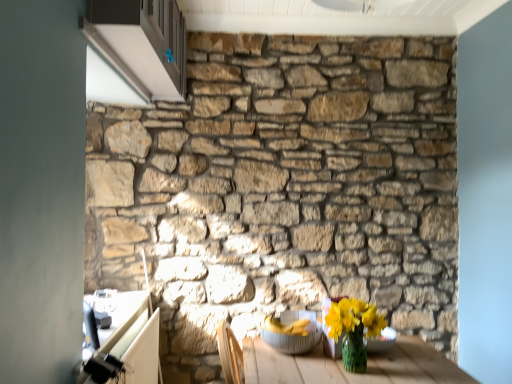
Question: Based on their positions, is natural stone wall at center located to the left or right of metallic silver bowl at lower center, which is counted as the first glass bowl, starting from the left?

Choices:
 (A) right
 (B) left

Answer: (B)

Question: Considering the positions of point (440, 170) and point (309, 319), is point (440, 170) closer or farther from the camera than point (309, 319)?

Choices:
 (A) farther
 (B) closer

Answer: (A)

Question: Which of these objects is positioned closest to the natural stone wall at center?

Choices:
 (A) metallic silver bowl at lower center, the 2th glass bowl viewed from the right
 (B) yellow matte vase at lower right
 (C) white glossy cabinet at upper left
 (D) translucent glass bowl at lower right, which appears as the 1th glass bowl when viewed from the right

Answer: (C)

Question: Considering the real-world distances, which object is farthest from the natural stone wall at center?

Choices:
 (A) translucent glass bowl at lower right, which appears as the 1th glass bowl when viewed from the right
 (B) metallic silver bowl at lower center, the 2th glass bowl viewed from the right
 (C) white glossy cabinet at upper left
 (D) yellow matte vase at lower right

Answer: (D)